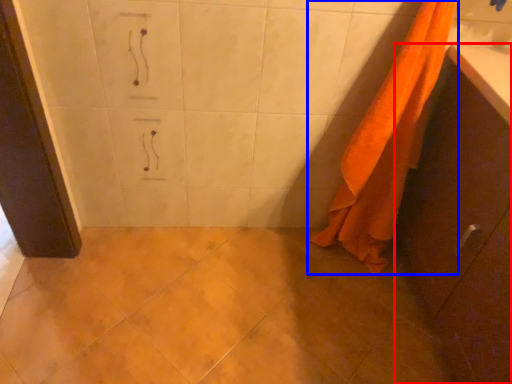
Question: Which point is further to the camera, bathroom cabinet (highlighted by a red box) or towel (highlighted by a blue box)?

Choices:
 (A) bathroom cabinet
 (B) towel

Answer: (B)